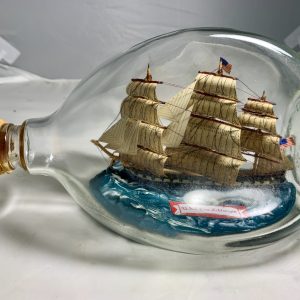
What are the coordinates of `white floor` in the screenshot? It's located at [x=87, y=250].